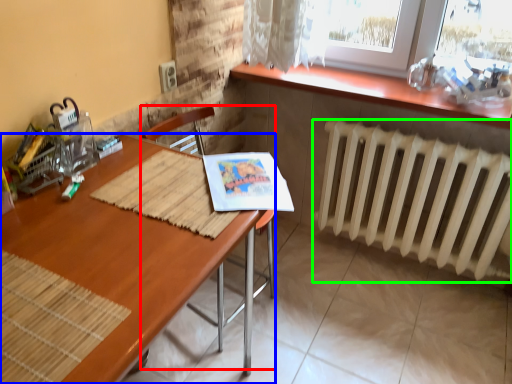
Question: Estimate the real-world distances between objects in this image. Which object is closer to armchair (highlighted by a red box), desk (highlighted by a blue box) or radiator (highlighted by a green box)?

Choices:
 (A) desk
 (B) radiator

Answer: (B)